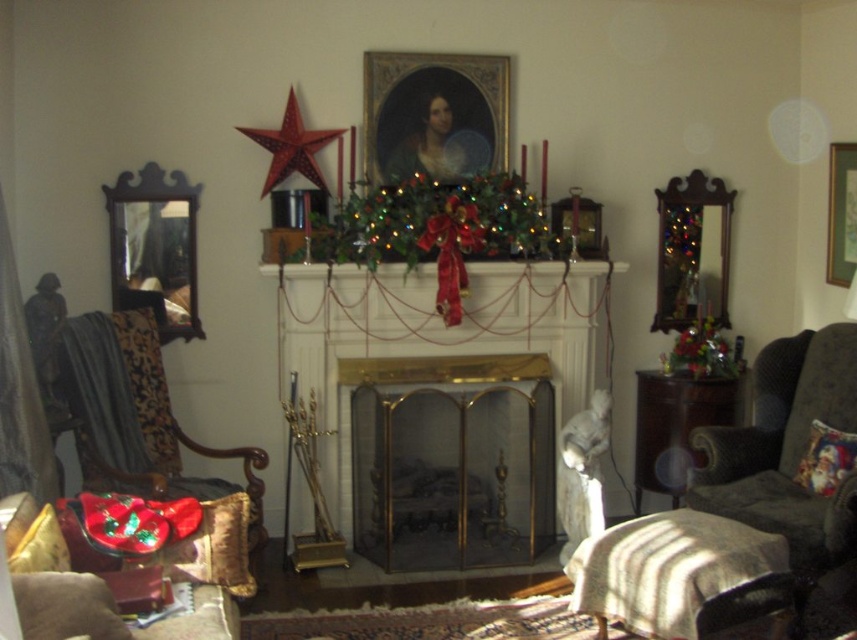
Consider the image. You are a guest in the living room and want to hang a small Christmas ornament. You have two options to place it either on the gold metallic fireplace at center or on the wooden picture frame at upper right. Which location would allow the ornament to be placed higher up?

The gold metallic fireplace at center is taller than the wooden picture frame at upper right, so placing the ornament on the gold metallic fireplace at center would allow it to be placed higher up.